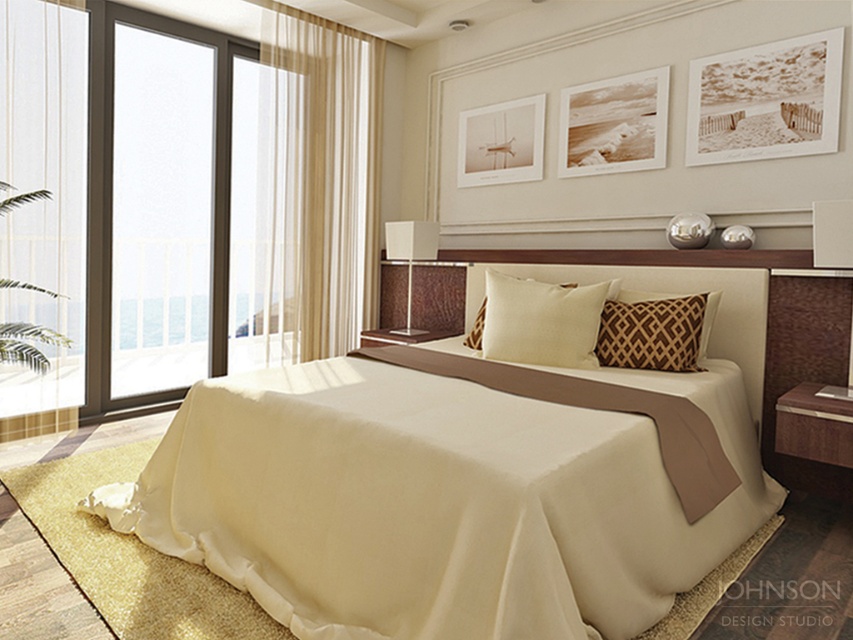
Between satin beige bed at center and transparent glass door at left, which one has less height?

With less height is satin beige bed at center.

Locate an element on the screen. The image size is (853, 640). satin beige bed at center is located at coordinates 461,484.

Locate an element on the screen. satin beige bed at center is located at coordinates (461, 484).

Does transparent glass door at left appear on the right side of creamy soft pillow at center?

No, transparent glass door at left is not to the right of creamy soft pillow at center.

How much distance is there between transparent glass door at left and creamy soft pillow at center?

transparent glass door at left is 2.19 meters away from creamy soft pillow at center.

Who is more distant from viewer, (94, 237) or (540, 358)?

Point (94, 237)

Find the location of a particular element. transparent glass door at left is located at coordinates (111, 195).

Between satin beige bed at center and brown textured pillow at center, which one is positioned lower?

Positioned lower is satin beige bed at center.

Does point (648, 424) come farther from viewer compared to point (677, 305)?

No, it is in front of (677, 305).

Between point (486, 580) and point (714, 308), which one is positioned in front?

Point (486, 580) is in front.

You are a GUI agent. You are given a task and a screenshot of the screen. Output one action in this format:
    pyautogui.click(x=<x>, y=<y>)
    Task: Click on the satin beige bed at center
    Image resolution: width=853 pixels, height=640 pixels.
    Given the screenshot: What is the action you would take?
    pyautogui.click(x=461, y=484)